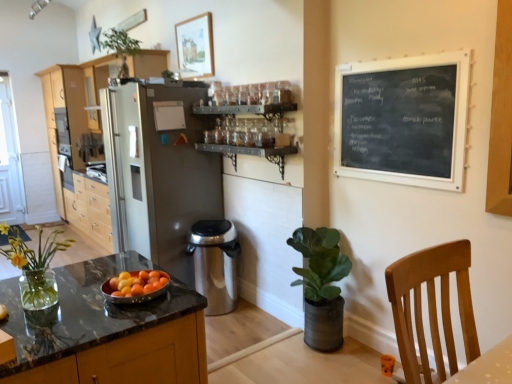
Locate an element on the screen. The width and height of the screenshot is (512, 384). free spot in front of metallic bowl of fruit at center is located at coordinates (106, 319).